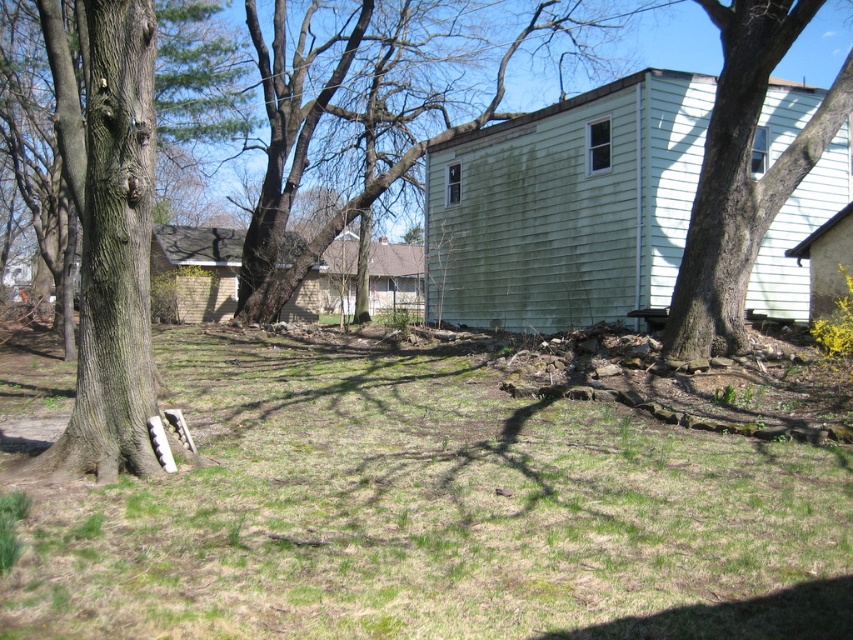
Question: Is green grass at center below smooth bark tree at right?

Choices:
 (A) yes
 (B) no

Answer: (A)

Question: Where is green grass at center located in relation to green painted wood siding at center right in the image?

Choices:
 (A) left
 (B) right

Answer: (A)

Question: Does green grass at center appear on the right side of brown rough bark tree at left?

Choices:
 (A) no
 (B) yes

Answer: (B)

Question: Among these points, which one is farthest from the camera?

Choices:
 (A) (131, 145)
 (B) (766, 211)
 (C) (552, 154)

Answer: (C)

Question: Estimate the real-world distances between objects in this image. Which object is farther from the brown rough bark tree at left?

Choices:
 (A) green painted wood siding at center right
 (B) green grass at center
 (C) smooth bark tree at right

Answer: (C)

Question: Which of the following is the farthest from the observer?

Choices:
 (A) green painted wood siding at center right
 (B) smooth bark tree at right

Answer: (A)